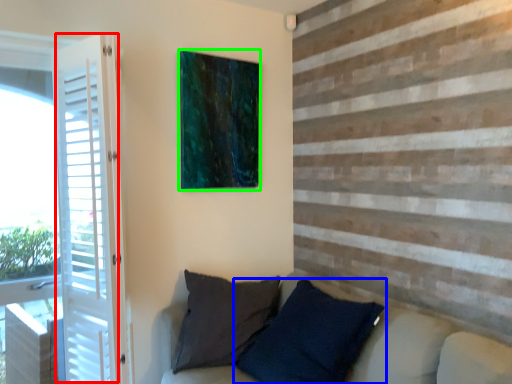
Question: Which object is positioned farthest from screen door (highlighted by a red box)? Select from pillow (highlighted by a blue box) and picture frame (highlighted by a green box).

Choices:
 (A) pillow
 (B) picture frame

Answer: (A)